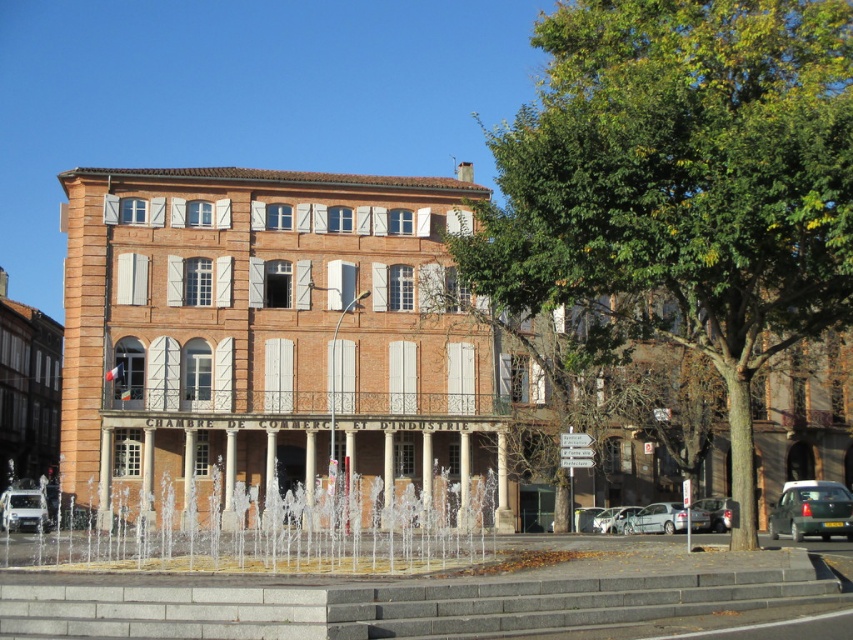
You are standing in front of the historical building and want to enter through the main entrance. The main entrance is located at the base of the gray concrete stairs at center. However, there is a green leafy tree at center blocking your path. Can you walk directly to the entrance without moving around the tree?

The gray concrete stairs at center is behind the green leafy tree at center, so you cannot walk directly to the entrance without moving around the tree.

You are a photographer standing in front of the historical building. You want to capture a wide shot that includes both the clear water at center and the silver metallic car at lower center. Given that your camera has a fixed focal length, which object should you position closer to the center of the frame to ensure both are fully visible?

Since the clear water at center is wider than the silver metallic car at lower center, you should position the clear water at center closer to the center of the frame to ensure both objects are fully visible within the shot.